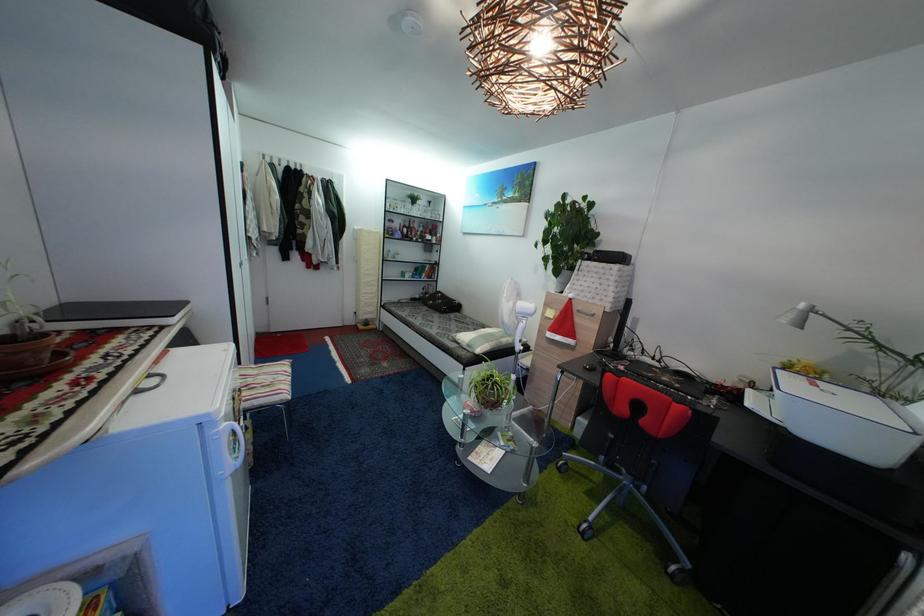
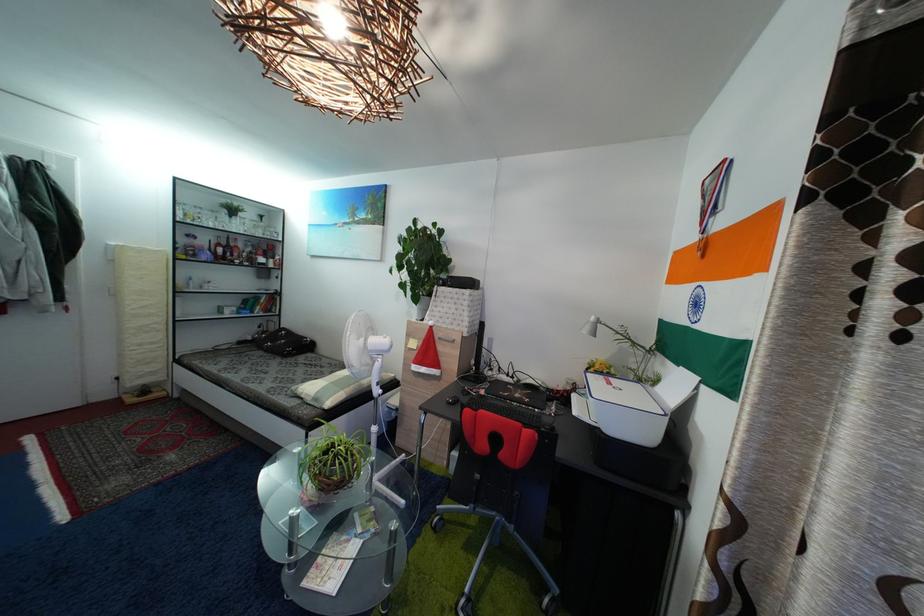
Where in the second image is the point corresponding to (x=434, y=211) from the first image?

(264, 225)